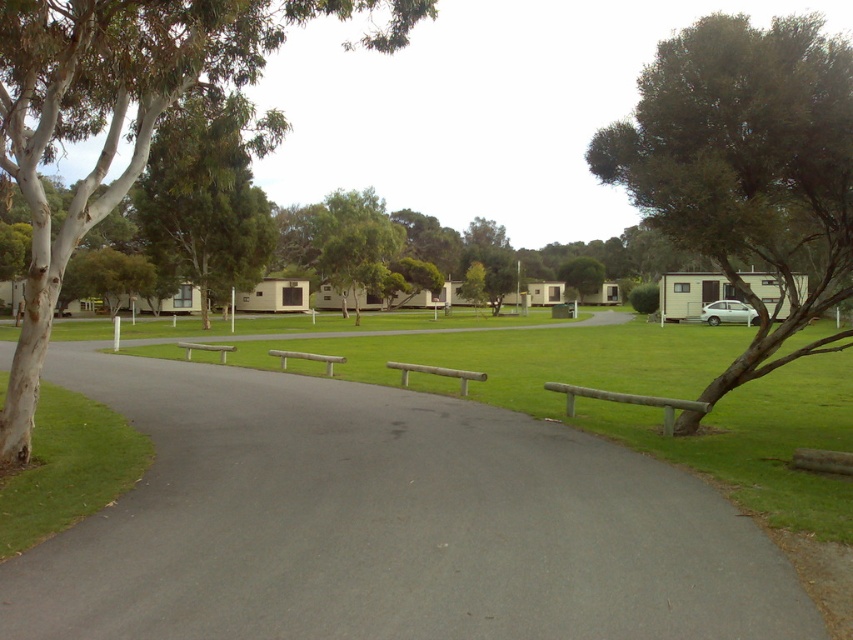
Is point (730, 300) positioned before point (325, 362)?

No, it is behind (325, 362).

Is white matte car at right positioned at the back of light brown wooden bench at center?

Yes, white matte car at right is behind light brown wooden bench at center.

Locate an element on the screen. This screenshot has width=853, height=640. white matte car at right is located at coordinates (728, 312).

Who is positioned more to the right, green leafy tree at upper right or green leafy tree at upper left?

Positioned to the right is green leafy tree at upper right.

Does green leafy tree at upper right appear on the right side of green leafy tree at upper left?

Yes, green leafy tree at upper right is to the right of green leafy tree at upper left.

Does point (697, 129) lie in front of point (254, 275)?

Yes, point (697, 129) is in front of point (254, 275).

Locate an element on the screen. green leafy tree at upper right is located at coordinates (747, 166).

Is white matte car at right smaller than wooden park bench at center?

Yes.

Does white matte car at right appear on the left side of wooden park bench at center?

Incorrect, white matte car at right is not on the left side of wooden park bench at center.

Describe the element at coordinates (728, 312) in the screenshot. I see `white matte car at right` at that location.

Where is `white matte car at right`? The width and height of the screenshot is (853, 640). white matte car at right is located at coordinates (728, 312).